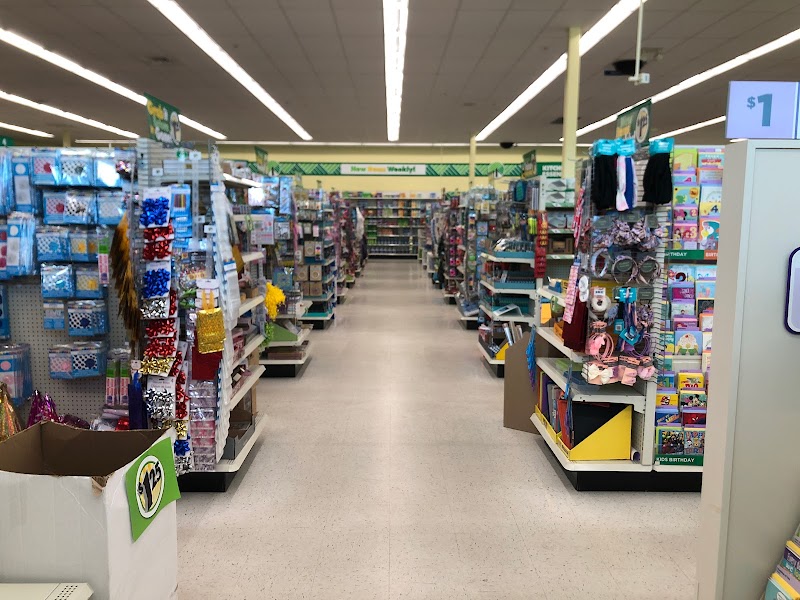
I want to click on decorative border, so click(x=312, y=167).